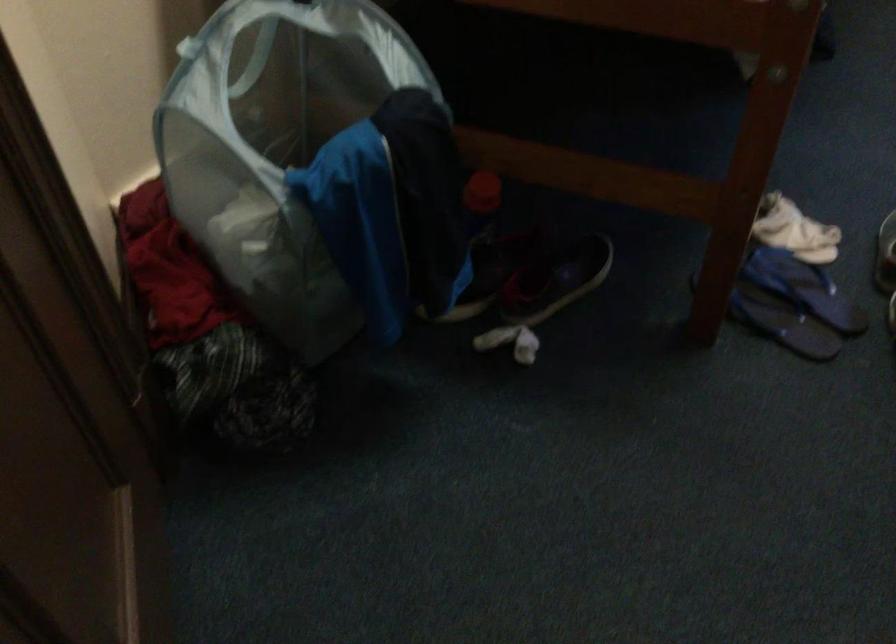
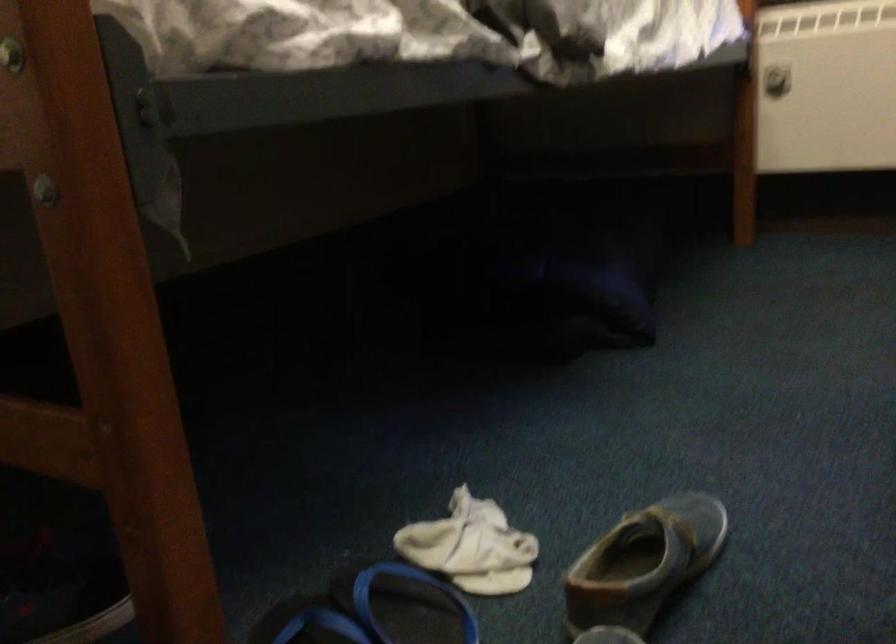
In a continuous first-person perspective shot, in which direction is the camera moving?

The cameraman walked toward right, forward.